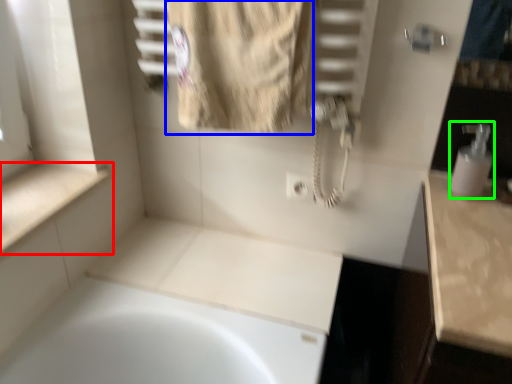
Question: Considering the real-world distances, which object is closest to counter top (highlighted by a red box)? bath towel (highlighted by a blue box) or soap dispenser (highlighted by a green box).

Choices:
 (A) bath towel
 (B) soap dispenser

Answer: (A)